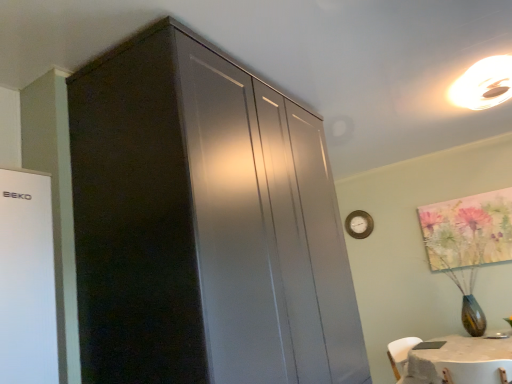
Question: From the image's perspective, would you say matte black cabinet at upper left is shown under matte white ceiling light at upper right?

Choices:
 (A) no
 (B) yes

Answer: (B)

Question: From a real-world perspective, is matte black cabinet at upper left below matte white ceiling light at upper right?

Choices:
 (A) yes
 (B) no

Answer: (A)

Question: Considering the relative sizes of matte black cabinet at upper left and matte white ceiling light at upper right in the image provided, is matte black cabinet at upper left taller than matte white ceiling light at upper right?

Choices:
 (A) no
 (B) yes

Answer: (B)

Question: Is matte black cabinet at upper left shorter than matte white ceiling light at upper right?

Choices:
 (A) no
 (B) yes

Answer: (A)

Question: Can you confirm if matte black cabinet at upper left is positioned to the right of matte white ceiling light at upper right?

Choices:
 (A) yes
 (B) no

Answer: (B)

Question: Does matte black cabinet at upper left have a larger size compared to matte white ceiling light at upper right?

Choices:
 (A) no
 (B) yes

Answer: (B)

Question: Are matte white ceiling light at upper right and wooden clock at upper right far apart?

Choices:
 (A) no
 (B) yes

Answer: (B)

Question: From the image's perspective, is matte white ceiling light at upper right located above wooden clock at upper right?

Choices:
 (A) yes
 (B) no

Answer: (A)

Question: Is matte white ceiling light at upper right next to wooden clock at upper right and touching it?

Choices:
 (A) no
 (B) yes

Answer: (A)

Question: From a real-world perspective, is matte white ceiling light at upper right over wooden clock at upper right?

Choices:
 (A) no
 (B) yes

Answer: (B)

Question: Considering the relative sizes of matte white ceiling light at upper right and wooden clock at upper right in the image provided, is matte white ceiling light at upper right bigger than wooden clock at upper right?

Choices:
 (A) no
 (B) yes

Answer: (B)

Question: Is wooden clock at upper right surrounded by matte white ceiling light at upper right?

Choices:
 (A) yes
 (B) no

Answer: (B)

Question: Does matte black cabinet at upper left have a lesser width compared to wooden clock at upper right?

Choices:
 (A) no
 (B) yes

Answer: (A)